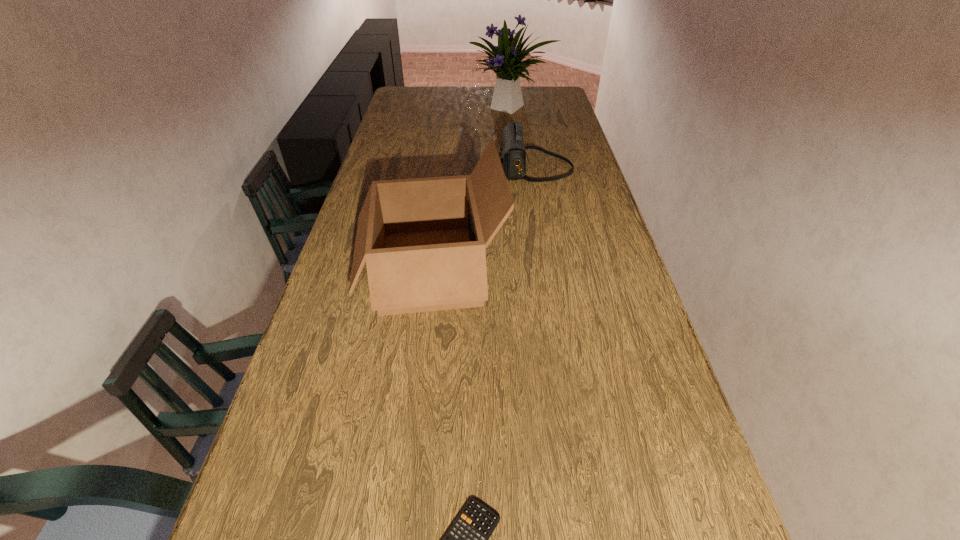
Where is `object at the left edge`? The width and height of the screenshot is (960, 540). object at the left edge is located at coordinates (x=423, y=239).

Where is `flower arrangement that is positioned at the right edge`? Image resolution: width=960 pixels, height=540 pixels. flower arrangement that is positioned at the right edge is located at coordinates (507, 97).

The image size is (960, 540). What are the coordinates of `shoulder bag located in the right edge section of the desktop` in the screenshot? It's located at (512, 151).

The height and width of the screenshot is (540, 960). In order to click on object that is at the far right corner in this screenshot , I will do `click(507, 97)`.

Locate an element on the screen. This screenshot has width=960, height=540. vacant region at the far edge is located at coordinates (440, 87).

Locate an element on the screen. This screenshot has height=540, width=960. vacant space at the left edge of the desktop is located at coordinates (417, 118).

In the image, there is a desktop. Where is `vacant space at the right edge`? This screenshot has width=960, height=540. vacant space at the right edge is located at coordinates (606, 215).

The image size is (960, 540). I want to click on vacant space that is in between the farthest object and the shoulder bag, so click(523, 138).

Identify which object is the second closest to the second shortest object. Please provide its 2D coordinates. Your answer should be formatted as a tuple, i.e. [(x, y)], where the tuple contains the x and y coordinates of a point satisfying the conditions above.

[(507, 97)]

Where is `object that is the closest to the second shortest object`? The image size is (960, 540). object that is the closest to the second shortest object is located at coordinates (423, 239).